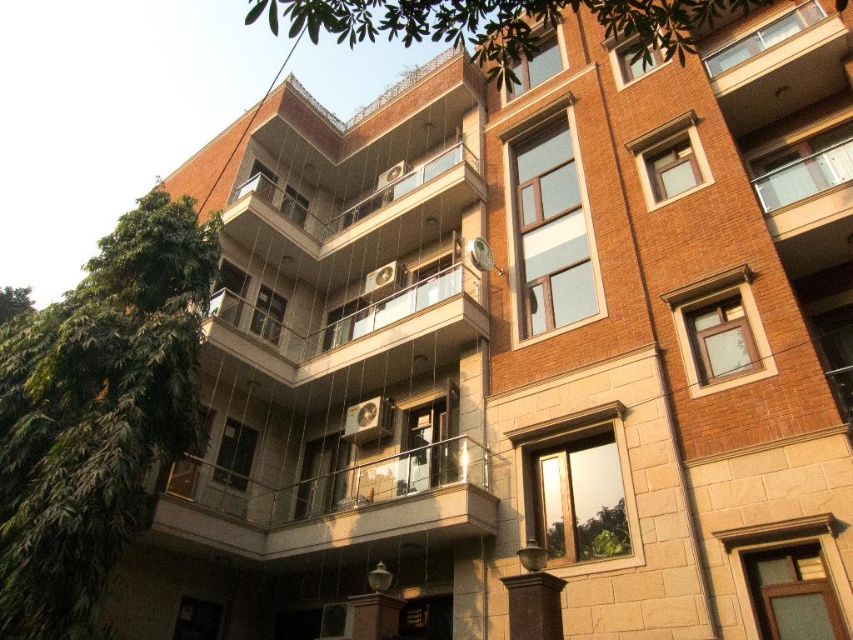
You are a window installer assessing the space between the green leafy tree at left and the metallic glass balcony at center. Can you determine if the tree is wider than the balcony?

The green leafy tree at left might be wider than metallic glass balcony at center, so the tree could potentially be wider than the balcony, but there is uncertainty in the measurement.

Based on the photo, you are standing in front of the residential building and want to take a photo of the green leafy tree at left. Based on its position, where should you aim your camera to capture it in the frame?

The green leafy tree at left is located at the 2D coordinates point (97,412), so you should aim your camera towards the lower left portion of the building to capture it in the frame.